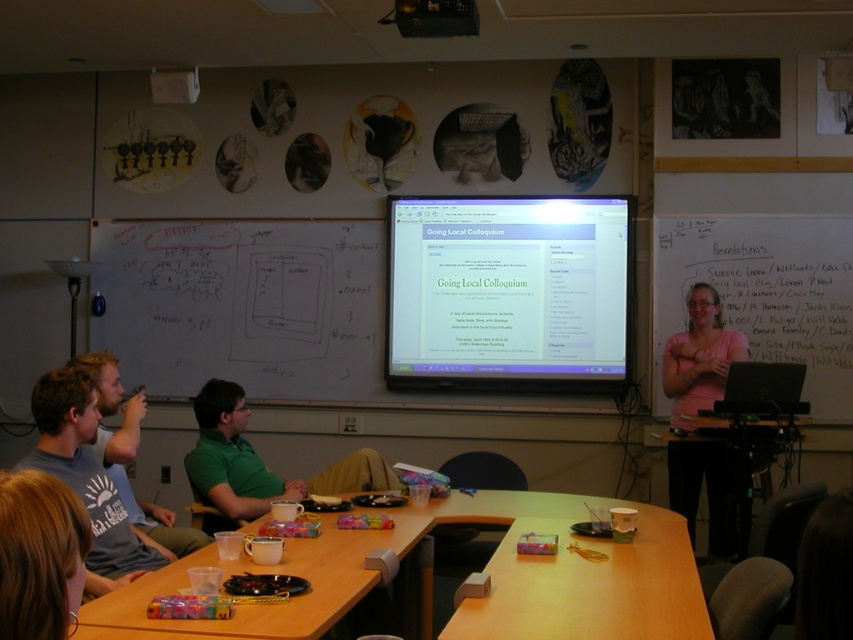
Is point (614, 609) closer to viewer compared to point (782, 260)?

Yes, point (614, 609) is closer to viewer.

Between wooden table at lower left and whiteboard at upper right, which one is positioned higher?

whiteboard at upper right is above.

Who is more forward, (572, 508) or (816, 362)?

Point (572, 508) is in front.

This screenshot has height=640, width=853. In order to click on wooden table at lower left in this screenshot , I will do `click(469, 600)`.

Is whiteboard at upper right thinner than gray cotton shirt at left?

No.

Can you confirm if whiteboard at upper right is shorter than gray cotton shirt at left?

In fact, whiteboard at upper right may be taller than gray cotton shirt at left.

Locate an element on the screen. The image size is (853, 640). whiteboard at upper right is located at coordinates (767, 291).

Is the position of wooden table at center more distant than that of gray cotton shirt at left?

No, it is in front of gray cotton shirt at left.

Does wooden table at center have a smaller size compared to gray cotton shirt at left?

Correct, wooden table at center occupies less space than gray cotton shirt at left.

What do you see at coordinates (581, 576) in the screenshot?
I see `wooden table at center` at bounding box center [581, 576].

I want to click on wooden table at center, so click(581, 576).